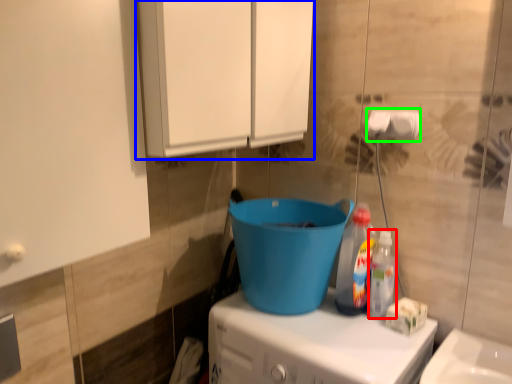
Question: Which is farther away from bottle (highlighted by a red box)? cabinetry (highlighted by a blue box) or toilet paper (highlighted by a green box)?

Choices:
 (A) cabinetry
 (B) toilet paper

Answer: (A)